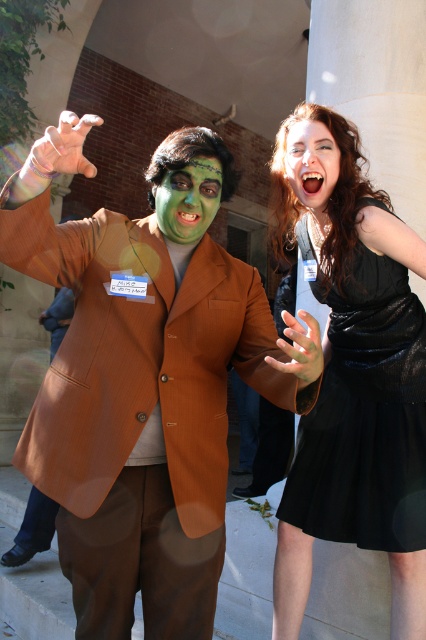
You are a photographer at a costume party. You need to decide whether to adjust the camera focus to capture both the black velvet dress at right and the matte black hair at upper right in the same frame. Given their height difference, which object should you focus on first to ensure both are in focus?

The black velvet dress at right is taller than the matte black hair at upper right, so focusing on the black velvet dress at right first will help ensure both are in focus since it is the taller object.

You are a photographer at an event and need to position two subjects for a group photo. The subjects are wearing the black velvet dress at right and have the green matte face at center. Based on their current positions, which subject should you move to the left to align them side by side?

The black velvet dress at right is to the right of the green matte face at center, so you should move the black velvet dress at right to the left to align them side by side.

You are a photographer trying to capture the green matte face at center in the image. The camera you are using has a focus point at coordinate point (189, 198). Will this focus point help you capture the green matte face at center clearly?

Yes, the focus point at point (189, 198) directly indicates the location of the green matte face at center, so using this focus point will help capture it clearly.